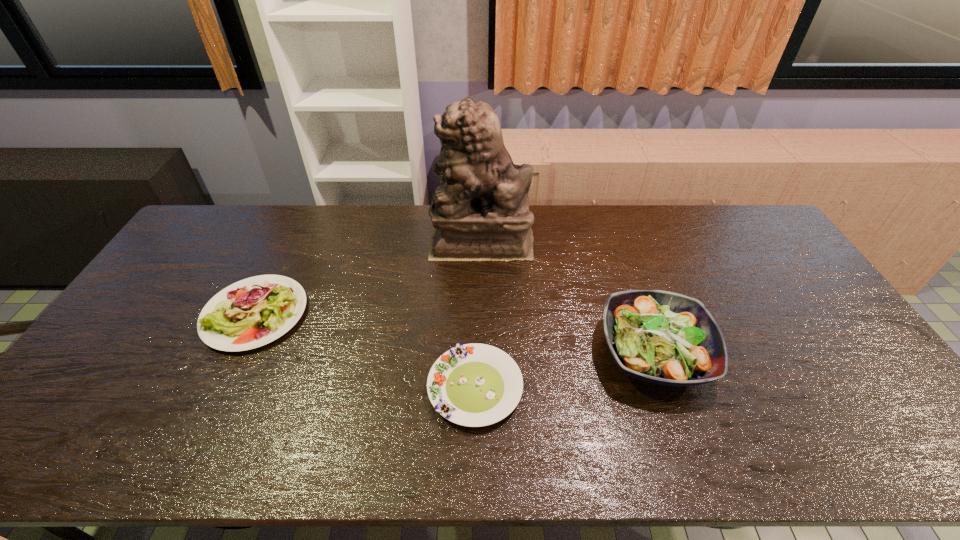
This screenshot has height=540, width=960. I want to click on vacant space located on the front-facing side of the tallest object, so click(x=320, y=240).

Where is `free space located on the back of the third shortest object`? free space located on the back of the third shortest object is located at coordinates (613, 237).

In order to click on vacant region located on the back of the leftmost object in this screenshot , I will do `click(305, 211)`.

This screenshot has height=540, width=960. I want to click on vacant space located 0.230m on the left of the shortest salad plate, so click(x=338, y=388).

This screenshot has width=960, height=540. I want to click on object at the far edge, so click(x=481, y=212).

Locate an element on the screen. object at the near edge is located at coordinates (474, 385).

Locate an element on the screen. vacant space at the far edge of the desktop is located at coordinates (427, 231).

Where is `free location at the left edge`? The image size is (960, 540). free location at the left edge is located at coordinates (177, 304).

The height and width of the screenshot is (540, 960). What are the coordinates of `vacant region at the near left corner` in the screenshot? It's located at (51, 436).

Find the location of a particular element. This screenshot has height=540, width=960. blank space at the far right corner is located at coordinates (742, 219).